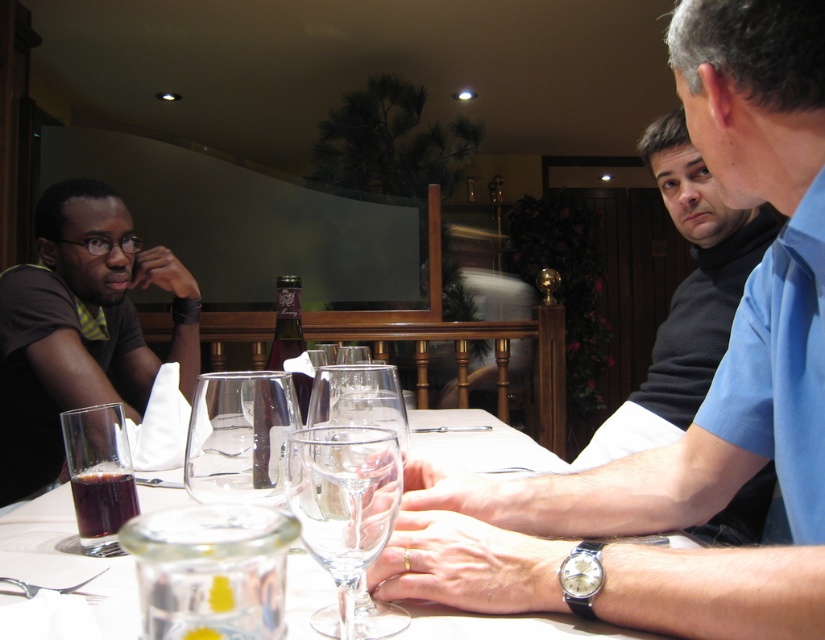
What do you see at coordinates (701, 403) in the screenshot? The height and width of the screenshot is (640, 825). I see `blue shirt at right` at bounding box center [701, 403].

Can you confirm if blue shirt at right is positioned above transparent glass wine glass at center?

Yes.

In order to click on blue shirt at right in this screenshot , I will do `click(701, 403)`.

Measure the distance from translucent glass at lower left to dark glass at table left.

translucent glass at lower left is 0.63 inches from dark glass at table left.

Between point (109, 486) and point (116, 500), which one is positioned in front?

Point (109, 486) is in front.

Does point (81, 540) come in front of point (88, 477)?

Yes, it is.

Locate an element on the screen. translucent glass at lower left is located at coordinates (99, 476).

Between black matte shirt at upper right and dark purple glass bottle at center, which one is positioned higher?

black matte shirt at upper right

Can you confirm if black matte shirt at upper right is wider than dark purple glass bottle at center?

Yes, black matte shirt at upper right is wider than dark purple glass bottle at center.

Is point (700, 284) farther from camera compared to point (269, 355)?

Yes, it is behind point (269, 355).

Find the location of a particular element. The height and width of the screenshot is (640, 825). black matte shirt at upper right is located at coordinates (686, 296).